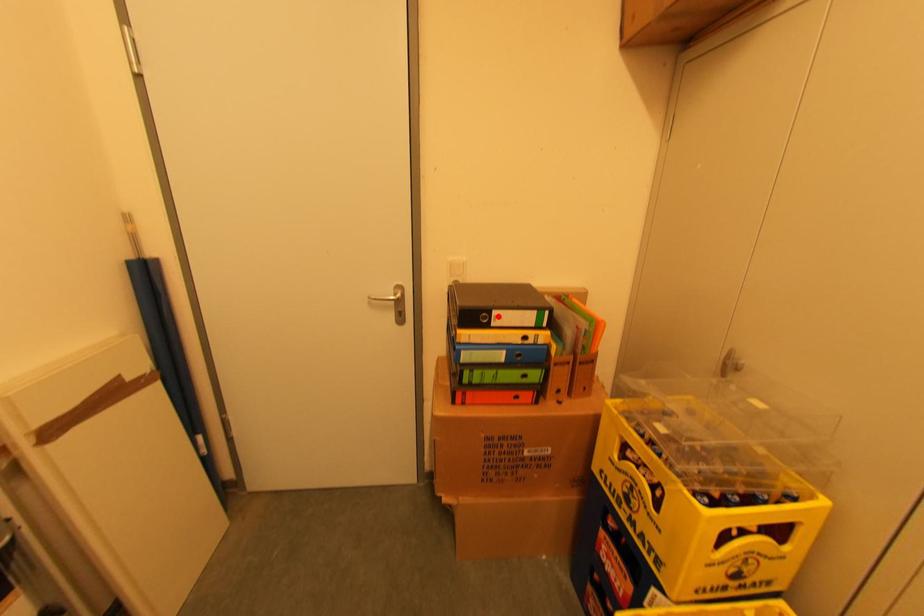
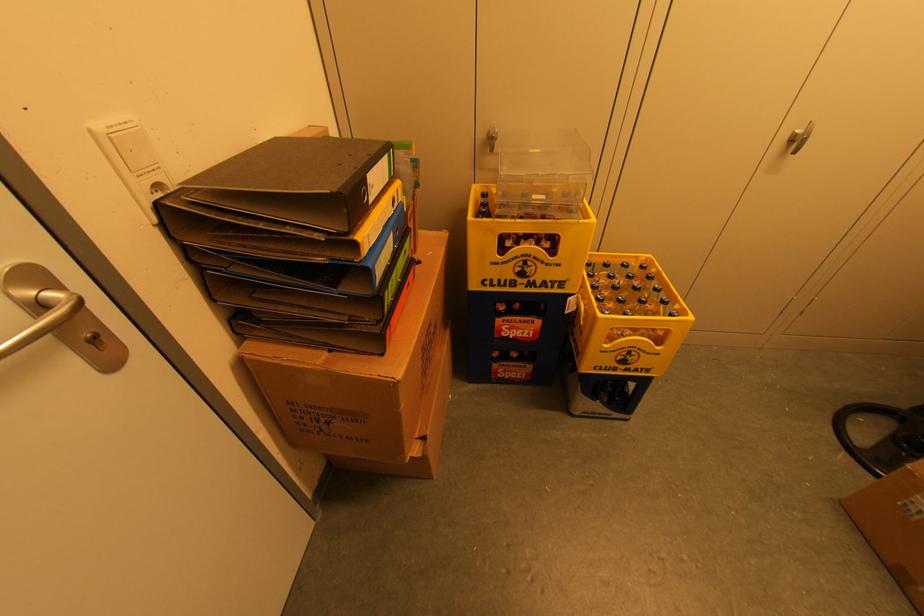
Question: I am providing you with two images of the same scene from different viewpoints. Given a red point in image1, look at the same physical point in image2. Is it:

Choices:
 (A) Closer to the viewpoint
 (B) Farther from the viewpoint

Answer: (A)